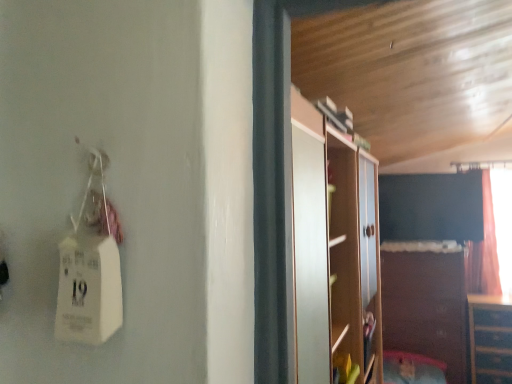
Question: From a real-world perspective, is wooden dresser at lower right, which appears as the first cabinetry when viewed from the right, positioned above or below brown matte cabinet at lower right, which is the 2th cabinetry from right to left?

Choices:
 (A) above
 (B) below

Answer: (B)

Question: Is wooden dresser at lower right, the second cabinetry when ordered from left to right, to the left or to the right of brown matte cabinet at lower right, marked as the first cabinetry in a left-to-right arrangement, in the image?

Choices:
 (A) left
 (B) right

Answer: (B)

Question: From the image's perspective, is wooden dresser at lower right, the second cabinetry when ordered from left to right, positioned above or below brown matte cabinet at lower right, which is the 2th cabinetry from right to left?

Choices:
 (A) below
 (B) above

Answer: (A)

Question: Is brown matte cabinet at lower right, which is the 2th cabinetry from right to left, inside the boundaries of wooden dresser at lower right, which appears as the first cabinetry when viewed from the right, or outside?

Choices:
 (A) inside
 (B) outside

Answer: (B)

Question: Visually, is brown matte cabinet at lower right, marked as the first cabinetry in a left-to-right arrangement, positioned to the left or to the right of wooden dresser at lower right, which appears as the first cabinetry when viewed from the right?

Choices:
 (A) right
 (B) left

Answer: (B)

Question: From a real-world perspective, is brown matte cabinet at lower right, marked as the first cabinetry in a left-to-right arrangement, physically located above or below wooden dresser at lower right, the second cabinetry when ordered from left to right?

Choices:
 (A) above
 (B) below

Answer: (A)

Question: Is brown matte cabinet at lower right, which is the 2th cabinetry from right to left, wider or thinner than wooden dresser at lower right, which appears as the first cabinetry when viewed from the right?

Choices:
 (A) thin
 (B) wide

Answer: (B)